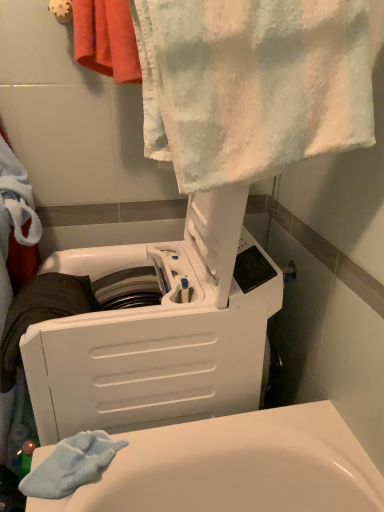
Question: Is the position of white textured towel at upper center, which is the second towel from back to front, more distant than that of white plastic washing machine at upper center?

Choices:
 (A) yes
 (B) no

Answer: (B)

Question: From the image's perspective, is white textured towel at upper center, which ranks as the 1th towel in front-to-back order, located beneath white plastic washing machine at upper center?

Choices:
 (A) yes
 (B) no

Answer: (B)

Question: Is white textured towel at upper center, which is the second towel from back to front, with white plastic washing machine at upper center?

Choices:
 (A) yes
 (B) no

Answer: (B)

Question: Considering the relative sizes of white textured towel at upper center, which ranks as the 1th towel in front-to-back order, and white plastic washing machine at upper center in the image provided, is white textured towel at upper center, which ranks as the 1th towel in front-to-back order, shorter than white plastic washing machine at upper center?

Choices:
 (A) no
 (B) yes

Answer: (B)

Question: Is white textured towel at upper center, which is the second towel from back to front, taller than white plastic washing machine at upper center?

Choices:
 (A) no
 (B) yes

Answer: (A)

Question: Is white textured towel at upper center, which is the second towel from back to front, taller or shorter than red cotton towel at upper left, which is the 2th towel from front to back?

Choices:
 (A) short
 (B) tall

Answer: (B)

Question: Considering their positions, is white textured towel at upper center, which is the second towel from back to front, located in front of or behind red cotton towel at upper left, which is the 2th towel from front to back?

Choices:
 (A) front
 (B) behind

Answer: (A)

Question: From a real-world perspective, is white textured towel at upper center, which ranks as the 1th towel in front-to-back order, physically located above or below red cotton towel at upper left, marked as the 1th towel in a back-to-front arrangement?

Choices:
 (A) above
 (B) below

Answer: (B)

Question: Based on their sizes in the image, would you say white textured towel at upper center, which ranks as the 1th towel in front-to-back order, is bigger or smaller than red cotton towel at upper left, marked as the 1th towel in a back-to-front arrangement?

Choices:
 (A) small
 (B) big

Answer: (B)

Question: Would you say white plastic washing machine at upper center is inside or outside red cotton towel at upper left, which is the 2th towel from front to back?

Choices:
 (A) inside
 (B) outside

Answer: (B)

Question: In terms of height, does white plastic washing machine at upper center look taller or shorter compared to red cotton towel at upper left, which is the 2th towel from front to back?

Choices:
 (A) tall
 (B) short

Answer: (A)

Question: Considering the positions of white plastic washing machine at upper center and red cotton towel at upper left, which is the 2th towel from front to back, in the image, is white plastic washing machine at upper center wider or thinner than red cotton towel at upper left, which is the 2th towel from front to back,?

Choices:
 (A) wide
 (B) thin

Answer: (A)

Question: Is white plastic washing machine at upper center bigger or smaller than red cotton towel at upper left, marked as the 1th towel in a back-to-front arrangement?

Choices:
 (A) small
 (B) big

Answer: (B)

Question: From a real-world perspective, is red cotton towel at upper left, marked as the 1th towel in a back-to-front arrangement, physically located above or below white textured towel at upper center, which ranks as the 1th towel in front-to-back order?

Choices:
 (A) above
 (B) below

Answer: (A)

Question: Does point (114, 25) appear closer or farther from the camera than point (180, 95)?

Choices:
 (A) closer
 (B) farther

Answer: (B)